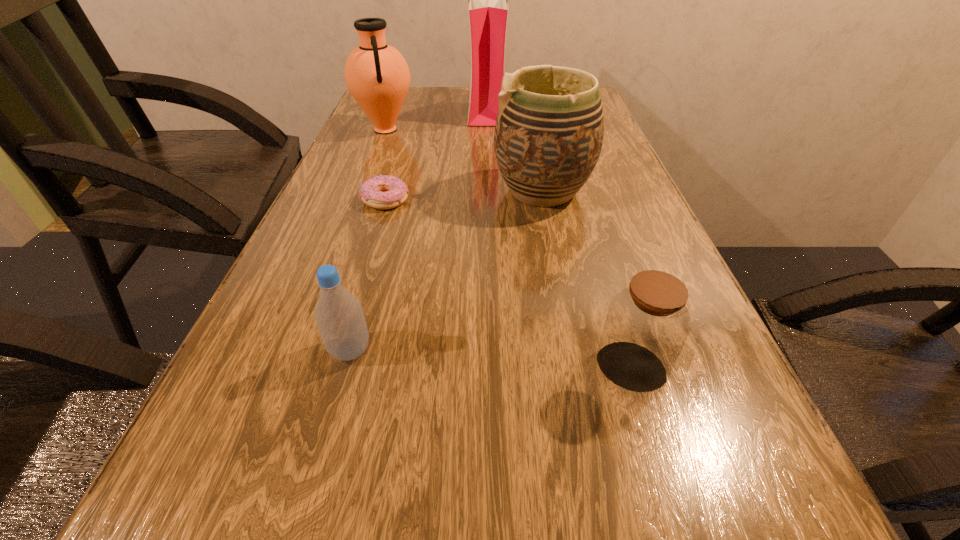
The width and height of the screenshot is (960, 540). I want to click on vacant space located 0.060m on the front of the pottery, so click(551, 235).

What are the coordinates of `free space located on the right of the bottle` in the screenshot? It's located at pyautogui.click(x=556, y=350).

Where is `free region located on the front of the jar`? The height and width of the screenshot is (540, 960). free region located on the front of the jar is located at coordinates (674, 511).

Find the location of a particular element. This screenshot has width=960, height=540. free space located on the right of the shortest object is located at coordinates (457, 199).

Find the location of a particular element. The image size is (960, 540). object located at the far edge is located at coordinates (488, 9).

Locate an element on the screen. pitcher that is at the left edge is located at coordinates (376, 74).

Where is `bottle positioned at the left edge`? bottle positioned at the left edge is located at coordinates (339, 316).

I want to click on doughnut at the left edge, so click(x=382, y=192).

Identify the location of pottery located in the right edge section of the desktop. This screenshot has width=960, height=540. (549, 131).

Identify the location of jar that is at the right edge. The image size is (960, 540). (647, 324).